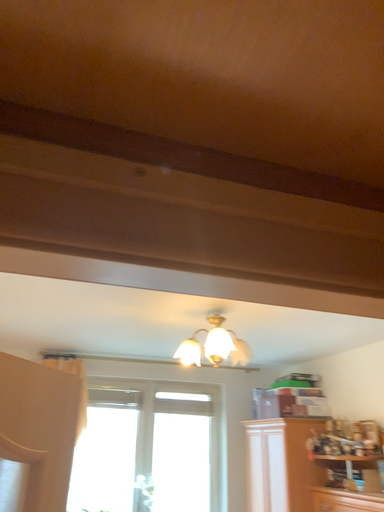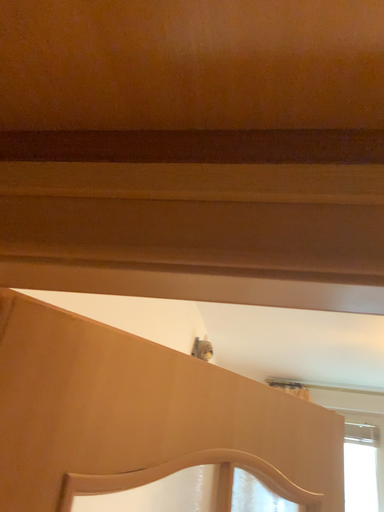
Question: Which way did the camera rotate in the video?

Choices:
 (A) rotated right
 (B) rotated left

Answer: (B)